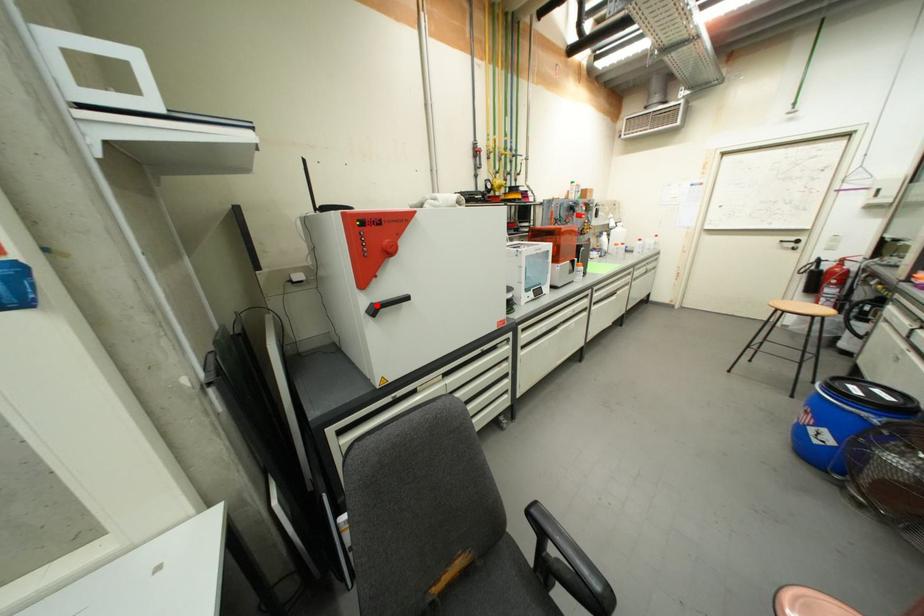
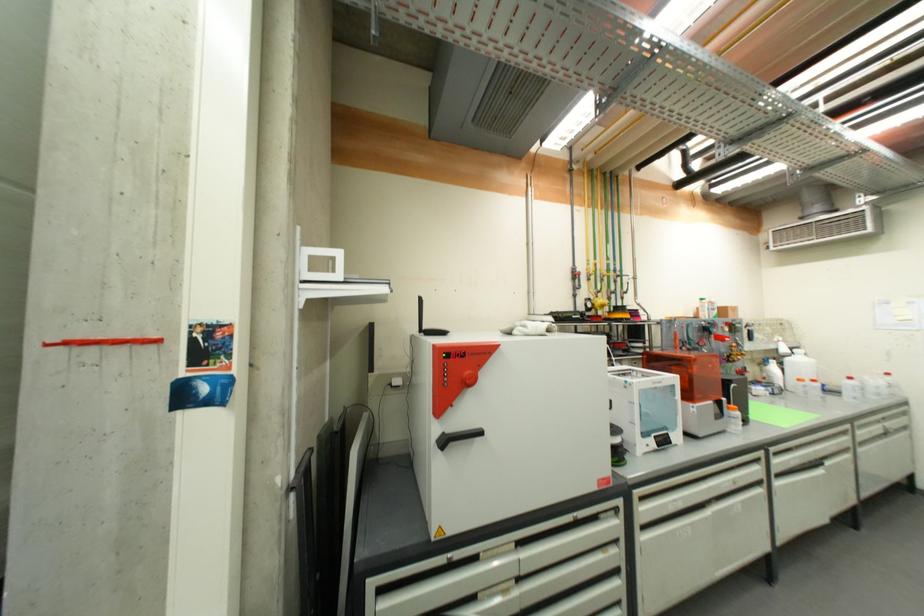
In the second image, find the point that corresponds to the highlighted location in the first image.

(448, 435)